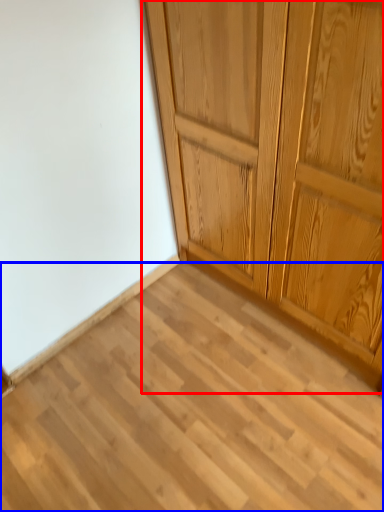
Question: Among these objects, which one is farthest to the camera, cupboard (highlighted by a red box) or plank (highlighted by a blue box)?

Choices:
 (A) cupboard
 (B) plank

Answer: (B)